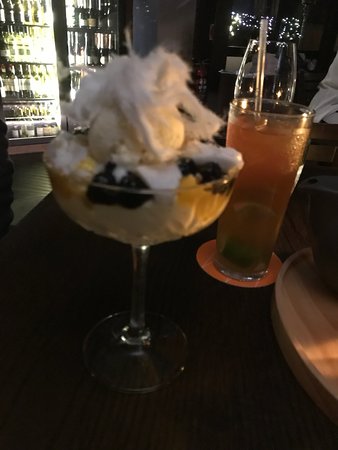
Where is `refridgerator light`? refridgerator light is located at coordinates click(48, 86).